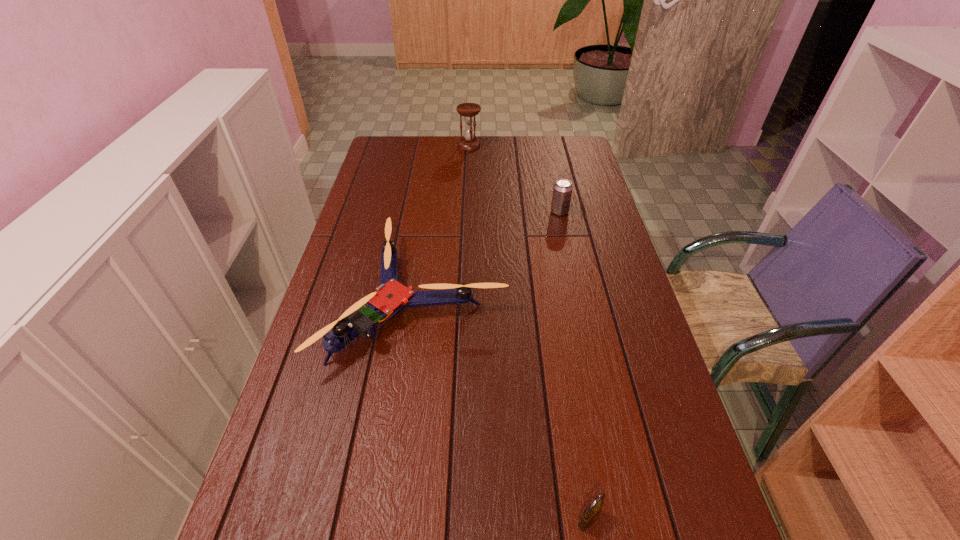
Find the location of a particular element. free space located on the right of the nearest object is located at coordinates (628, 519).

Find the location of a particular element. object positioned at the far edge is located at coordinates (469, 110).

Find the location of a particular element. object that is at the left edge is located at coordinates pos(391,297).

In order to click on object located in the right edge section of the desktop in this screenshot , I will do point(562,191).

In the image, there is a desktop. Where is `free space at the far edge`? free space at the far edge is located at coordinates (540, 156).

You are a GUI agent. You are given a task and a screenshot of the screen. Output one action in this format:
    pyautogui.click(x=<x>, y=<y>)
    Task: Click on the free space at the left edge of the desktop
    This screenshot has width=960, height=540.
    Given the screenshot: What is the action you would take?
    pyautogui.click(x=387, y=187)

The width and height of the screenshot is (960, 540). Find the location of `vacant space at the right edge of the desktop`. vacant space at the right edge of the desktop is located at coordinates (572, 232).

What are the coordinates of `vacant space that's between the farthest object and the second object from right to left` in the screenshot? It's located at (529, 333).

The image size is (960, 540). Identify the location of free spot between the beer can and the second nearest object. (490, 255).

This screenshot has height=540, width=960. In order to click on unoccupied area between the beer can and the padlock in this screenshot , I will do `click(574, 366)`.